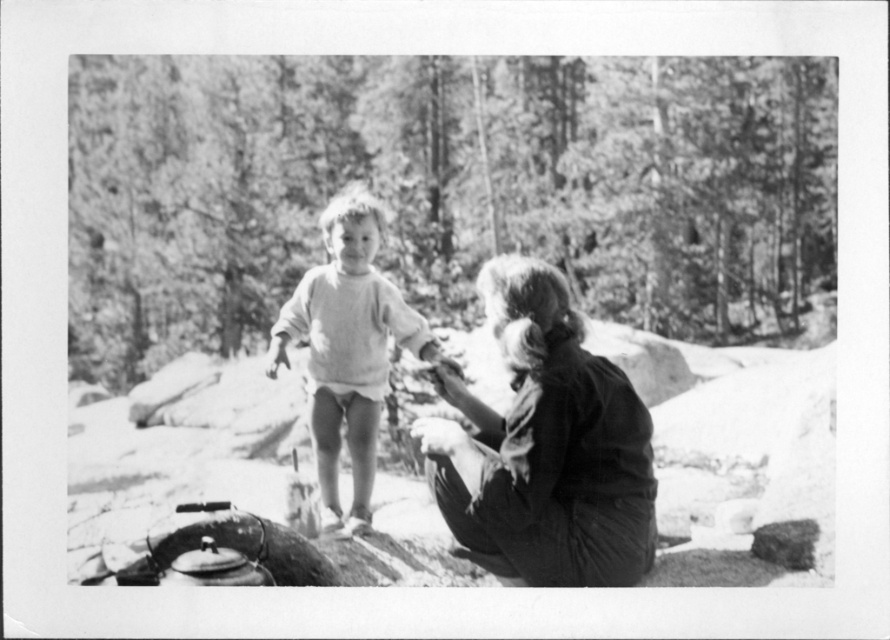
Question: Can you confirm if dark fabric skirt at center is thinner than white soft sweater at center?

Choices:
 (A) no
 (B) yes

Answer: (A)

Question: Which of the following is the farthest from the observer?

Choices:
 (A) dark fabric skirt at center
 (B) white soft sweater at center

Answer: (B)

Question: From the image, what is the correct spatial relationship of dark fabric skirt at center in relation to white soft sweater at center?

Choices:
 (A) right
 (B) left

Answer: (A)

Question: Can you confirm if dark fabric skirt at center is positioned below white soft sweater at center?

Choices:
 (A) no
 (B) yes

Answer: (B)